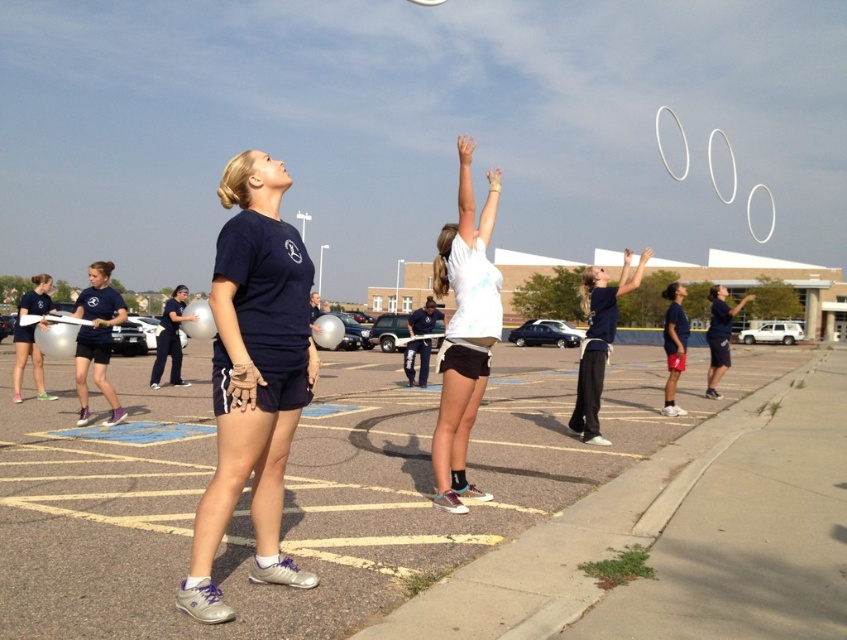
Question: Is the position of navy blue t-shirt at center less distant than that of white matte shorts at center?

Choices:
 (A) yes
 (B) no

Answer: (A)

Question: Which point is farther to the camera?

Choices:
 (A) (224, 468)
 (B) (452, 266)

Answer: (B)

Question: Can you confirm if navy blue t-shirt at center is positioned below white matte shorts at center?

Choices:
 (A) no
 (B) yes

Answer: (B)

Question: Which point appears farthest from the camera in this image?

Choices:
 (A) [480, 492]
 (B) [231, 433]

Answer: (A)

Question: Does navy blue t-shirt at center have a larger size compared to white matte shorts at center?

Choices:
 (A) no
 (B) yes

Answer: (B)

Question: Which of the following is the closest to the observer?

Choices:
 (A) (252, 305)
 (B) (464, 385)

Answer: (A)